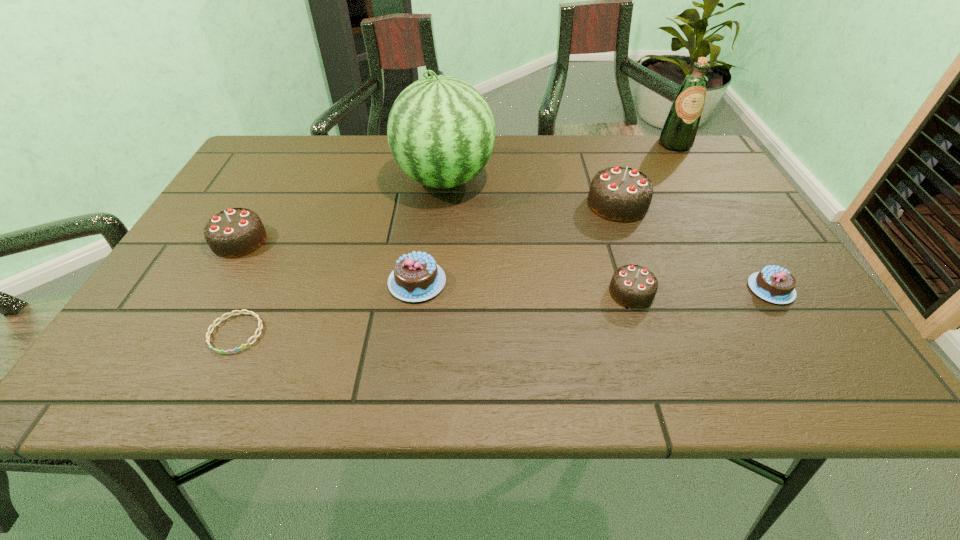
Locate an element on the screen. The width and height of the screenshot is (960, 540). the fifth closest chocolate cake to the green olive oil is located at coordinates (235, 232).

Identify the location of chocolate chocolate cake object that ranks as the second closest to the blue bracelet. This screenshot has height=540, width=960. (634, 286).

Identify which chocolate chocolate cake is the third nearest to the left pink chocolate cake. Please provide its 2D coordinates. Your answer should be formatted as a tuple, i.e. [(x, y)], where the tuple contains the x and y coordinates of a point satisfying the conditions above.

[(622, 194)]

This screenshot has height=540, width=960. I want to click on vacant space that satisfies the following two spatial constraints: 1. on the back side of the nearest chocolate chocolate cake; 2. on the left side of the second shortest object, so click(631, 289).